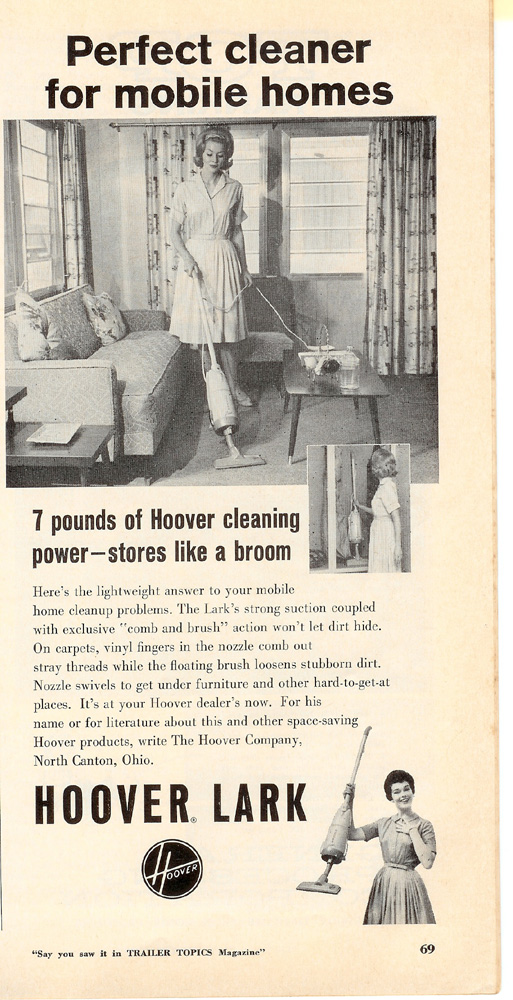
In order to click on vacuum cleaner cord in this screenshot , I will do `click(234, 298)`, `click(290, 331)`.